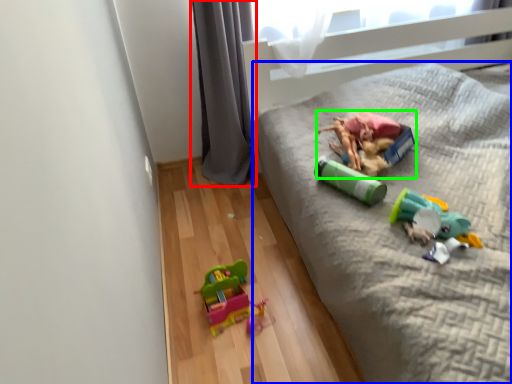
Question: Which is farther away from curtain (highlighted by a red box)? furniture (highlighted by a blue box) or toy (highlighted by a green box)?

Choices:
 (A) furniture
 (B) toy

Answer: (B)